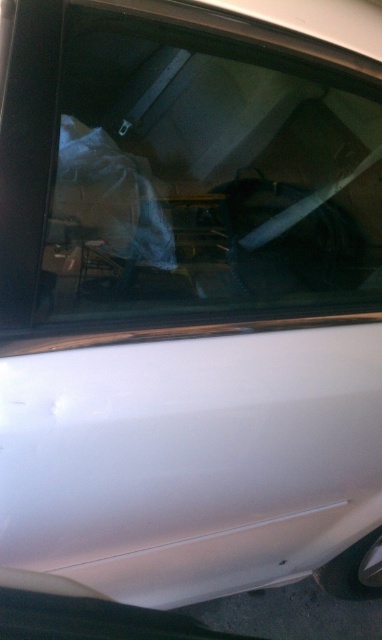
Question: Can you confirm if transparent plastic bag at upper center is wider than white glossy car door at lower left?

Choices:
 (A) yes
 (B) no

Answer: (B)

Question: Which object is farther from the camera taking this photo?

Choices:
 (A) white glossy car door at lower left
 (B) transparent plastic bag at upper center

Answer: (A)

Question: Which object appears closest to the camera in this image?

Choices:
 (A) transparent plastic bag at upper center
 (B) white glossy car door at lower left

Answer: (A)

Question: Does transparent plastic bag at upper center appear over white glossy car door at lower left?

Choices:
 (A) yes
 (B) no

Answer: (A)

Question: Which point is closer to the camera?

Choices:
 (A) (231, 179)
 (B) (111, 538)

Answer: (B)

Question: Can you confirm if transparent plastic bag at upper center is bigger than white glossy car door at lower left?

Choices:
 (A) yes
 (B) no

Answer: (B)